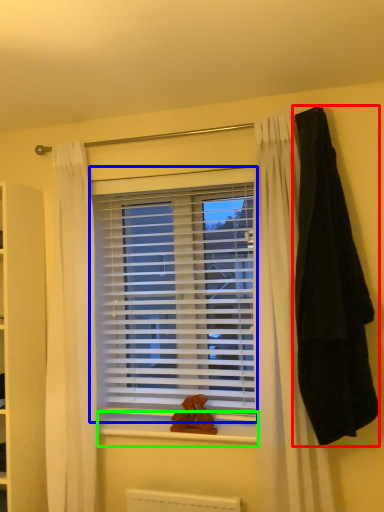
Question: Based on their relative distances, which object is nearer to blanket (highlighted by a red box)? Choose from window blind (highlighted by a blue box) and window sill (highlighted by a green box).

Choices:
 (A) window blind
 (B) window sill

Answer: (A)